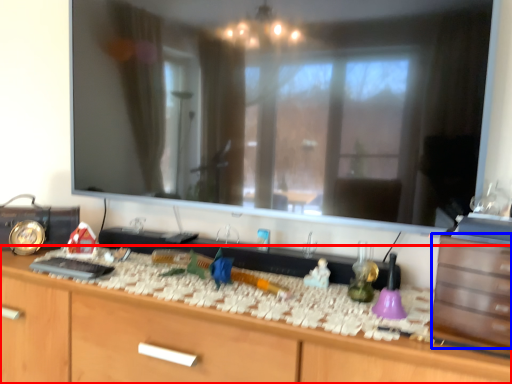
Question: Among these objects, which one is farthest to the camera, cabinetry (highlighted by a red box) or drawer (highlighted by a blue box)?

Choices:
 (A) cabinetry
 (B) drawer

Answer: (B)